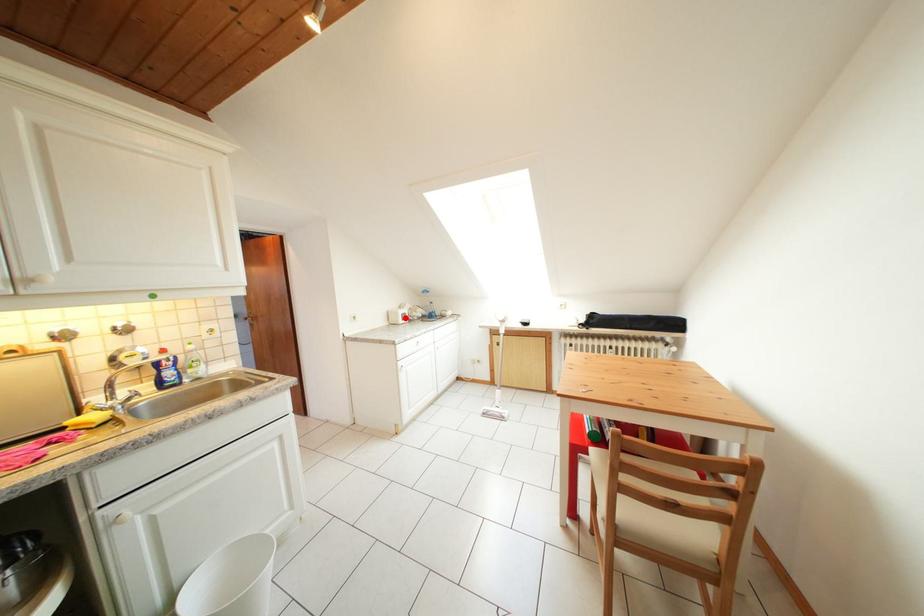
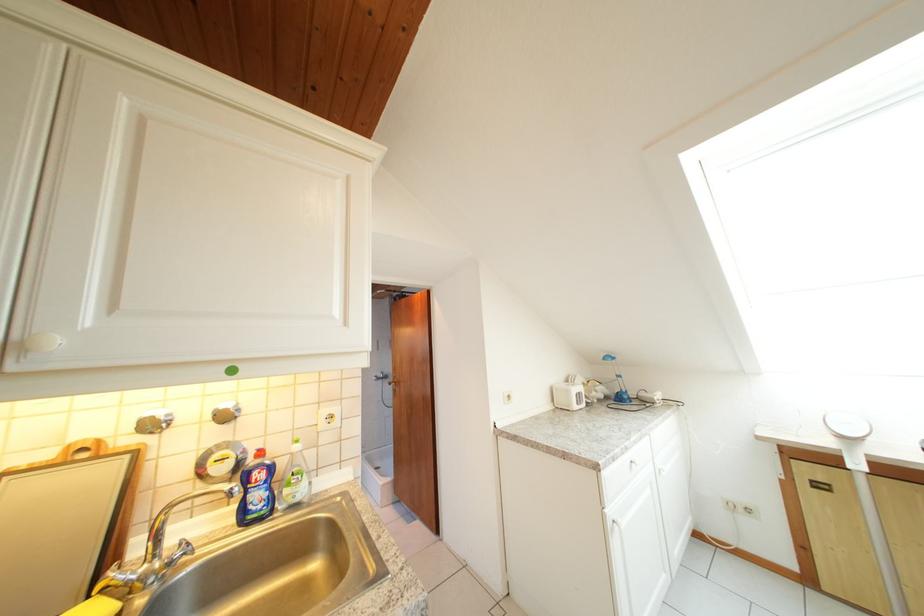
Where in the second image is the point corresponding to the highlighted location from the first image?

(577, 397)